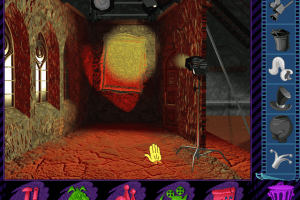
This screenshot has height=200, width=300. I want to click on light, so click(182, 61).